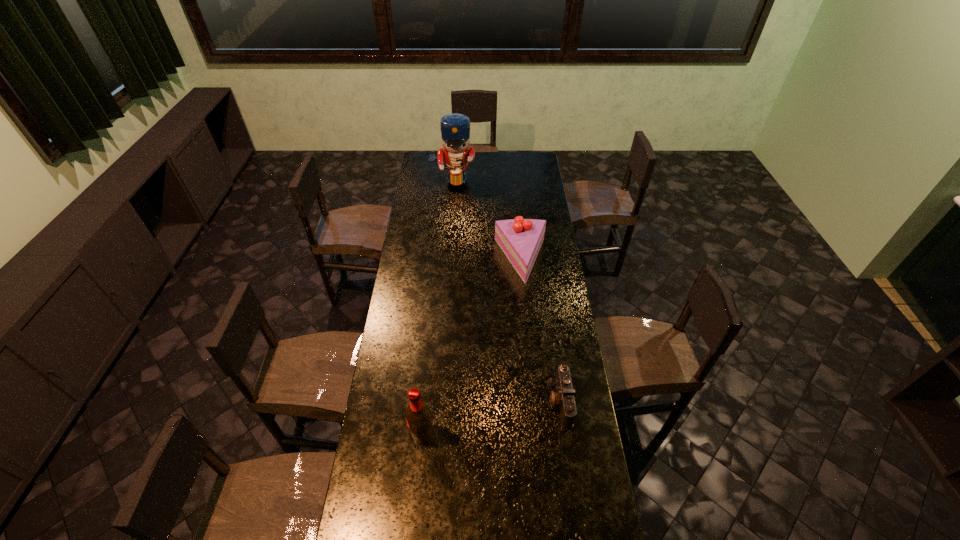
The height and width of the screenshot is (540, 960). In order to click on vacant region located 0.070m on the front-facing side of the shortest object in this screenshot , I will do 529,402.

This screenshot has width=960, height=540. I want to click on vacant space located 0.200m on the front-facing side of the shortest object, so click(494, 402).

In order to click on object situated at the far edge in this screenshot , I will do pyautogui.click(x=455, y=128).

Find the location of a particular element. This screenshot has height=540, width=960. nutcracker that is at the left edge is located at coordinates (455, 128).

Identify the location of beer bottle located in the left edge section of the desktop. This screenshot has width=960, height=540. (418, 416).

Where is `cake that is at the right edge`? cake that is at the right edge is located at coordinates (520, 239).

This screenshot has width=960, height=540. Find the location of `camera that is at the right edge`. camera that is at the right edge is located at coordinates (564, 398).

Identify the location of object present at the far left corner. pyautogui.click(x=455, y=128).

Find the location of `free space at the left edge`. free space at the left edge is located at coordinates (391, 377).

Identify the location of free spot at the right edge of the desktop. This screenshot has height=540, width=960. (542, 247).